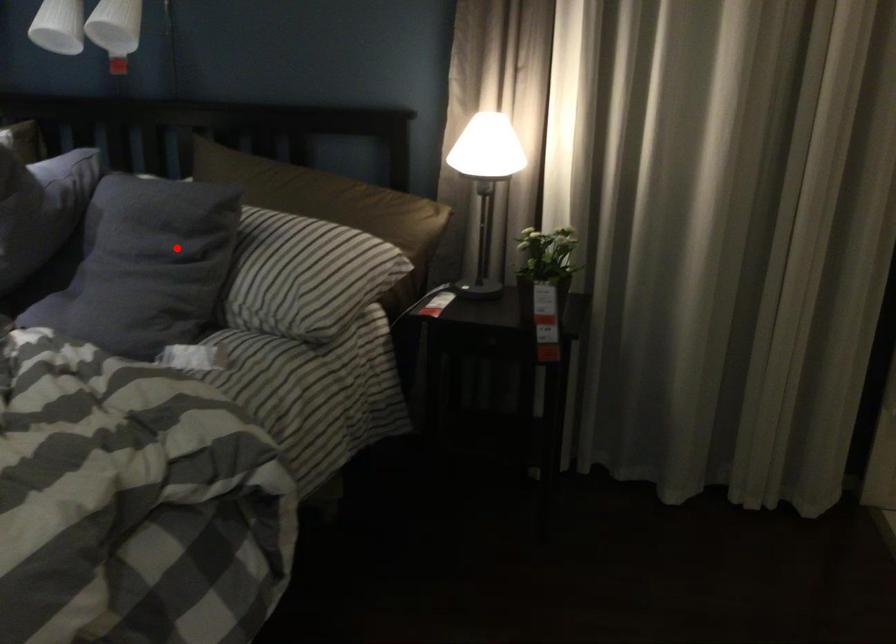
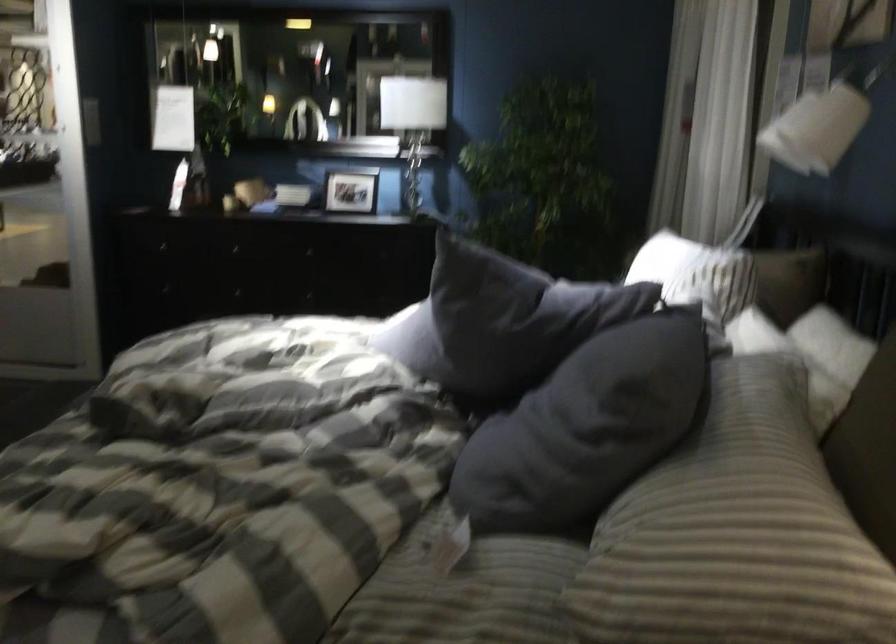
In the second image, find the point that corresponds to the highlighted location in the first image.

(596, 415)